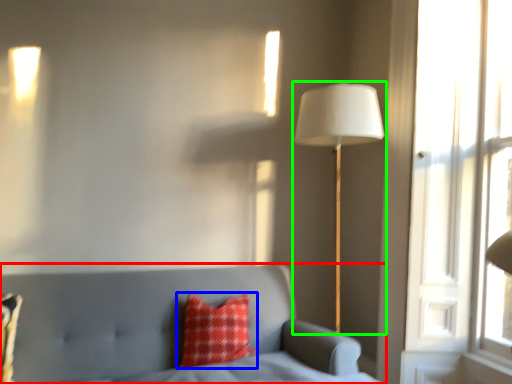
Question: Considering the real-world distances, which object is closest to furniture (highlighted by a red box)? pillow (highlighted by a blue box) or lamp (highlighted by a green box).

Choices:
 (A) pillow
 (B) lamp

Answer: (A)